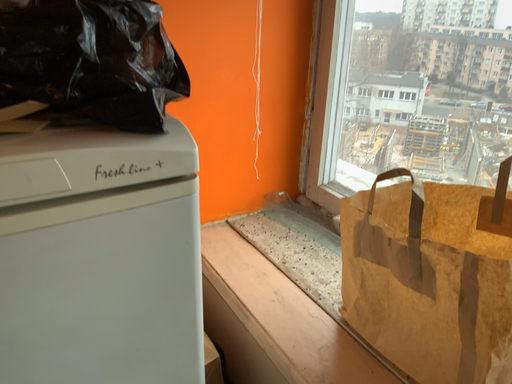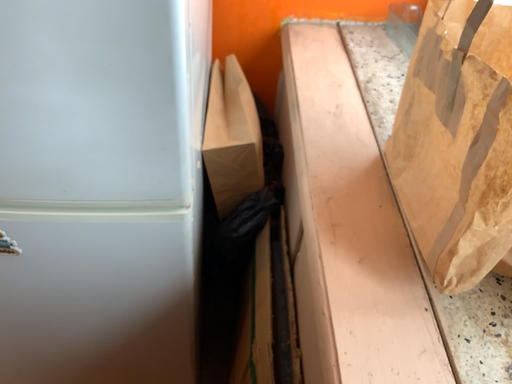
Question: How did the camera likely rotate when shooting the video?

Choices:
 (A) rotated left
 (B) rotated right

Answer: (A)